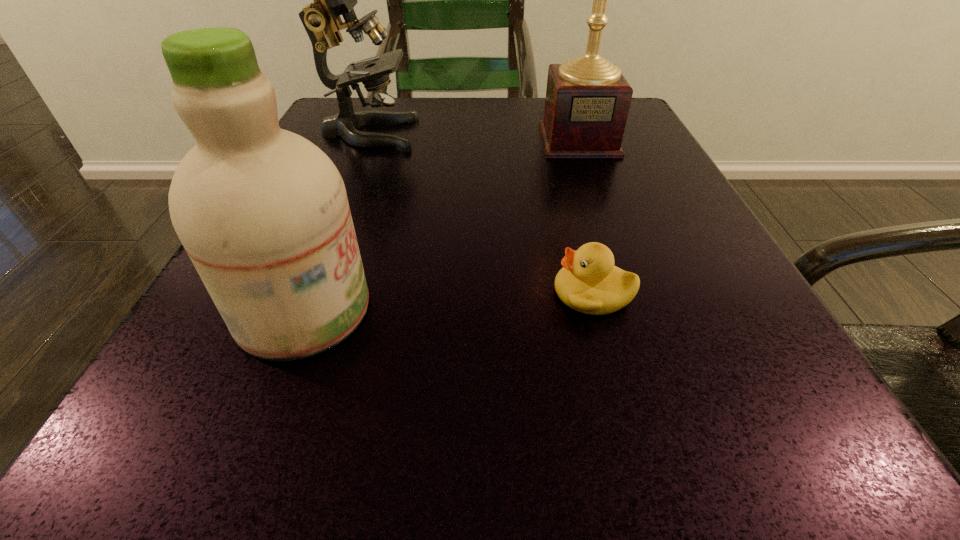
At what (x,y) coordinates should I click in order to perform the action: click on vacant space at the right edge of the desktop. Please return your answer as a coordinate pair (x, y). The height and width of the screenshot is (540, 960). Looking at the image, I should click on (658, 213).

Locate an element on the screen. The height and width of the screenshot is (540, 960). vacant space at the near left corner of the desktop is located at coordinates (286, 461).

The height and width of the screenshot is (540, 960). What are the coordinates of `vacant space at the near right corner of the desktop` in the screenshot? It's located at (792, 476).

Where is `unoccupied area between the trophy cup and the shortest object`? unoccupied area between the trophy cup and the shortest object is located at coordinates (586, 217).

Image resolution: width=960 pixels, height=540 pixels. Identify the location of vacant area that lies between the duckling and the tallest object. (586, 217).

The image size is (960, 540). What are the coordinates of `free spot between the second shortest object and the duckling` in the screenshot? It's located at (448, 301).

Where is `vacant space that's between the shortest object and the microscope`? vacant space that's between the shortest object and the microscope is located at coordinates (481, 213).

At what (x,y) coordinates should I click in order to perform the action: click on vacant space in between the microscope and the shortest object. Please return your answer as a coordinate pair (x, y). Looking at the image, I should click on (481, 213).

This screenshot has height=540, width=960. Identify the location of empty space that is in between the trophy cup and the shortest object. (586, 217).

What are the coordinates of `empty space between the shortest object and the tallest object` in the screenshot? It's located at (586, 217).